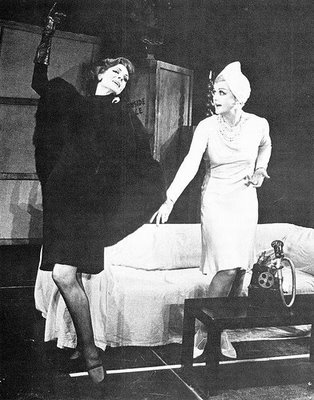
Find the location of a particular element. The width and height of the screenshot is (314, 400). legs of coffee table is located at coordinates (184, 326), (210, 354).